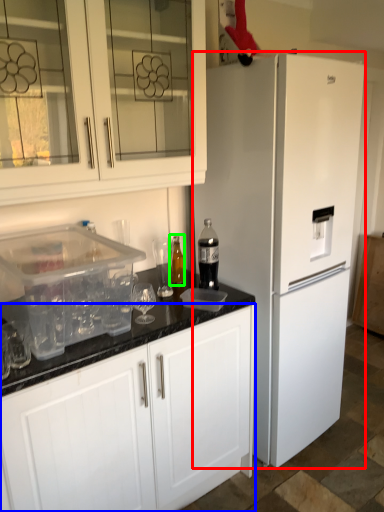
Question: Which is nearer to the refrigerator (highlighted by a red box)? cabinetry (highlighted by a blue box) or bottle (highlighted by a green box).

Choices:
 (A) cabinetry
 (B) bottle

Answer: (A)